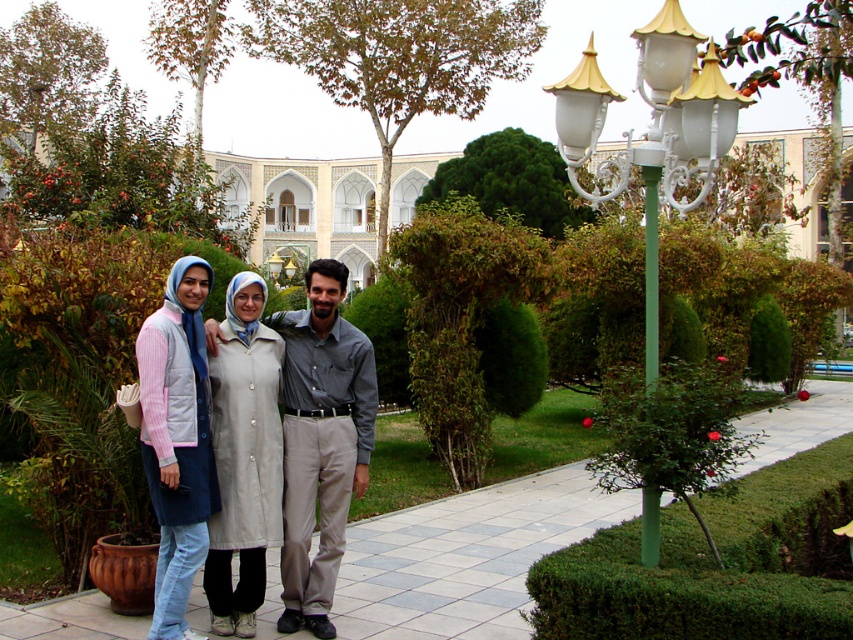
Question: Is light gray fabric coat at center smaller than light pink striped shirt at center?

Choices:
 (A) no
 (B) yes

Answer: (A)

Question: Which of the following is the farthest from the observer?

Choices:
 (A) (233, 634)
 (B) (572, 88)
 (C) (193, 470)
 (D) (231, 477)

Answer: (D)

Question: Is gray cotton shirt at center closer to the viewer compared to white glossy lamp post at upper right?

Choices:
 (A) yes
 (B) no

Answer: (B)

Question: Which object is farther from the camera taking this photo?

Choices:
 (A) gray cotton shirt at center
 (B) white glossy lamp post at upper right

Answer: (A)

Question: Where is white glossy lamp post at upper right located in relation to beige fabric coat at center in the image?

Choices:
 (A) above
 (B) below

Answer: (A)

Question: Which point is farther from the camera taking this photo?

Choices:
 (A) (171, 387)
 (B) (637, 33)
 (C) (235, 528)

Answer: (C)